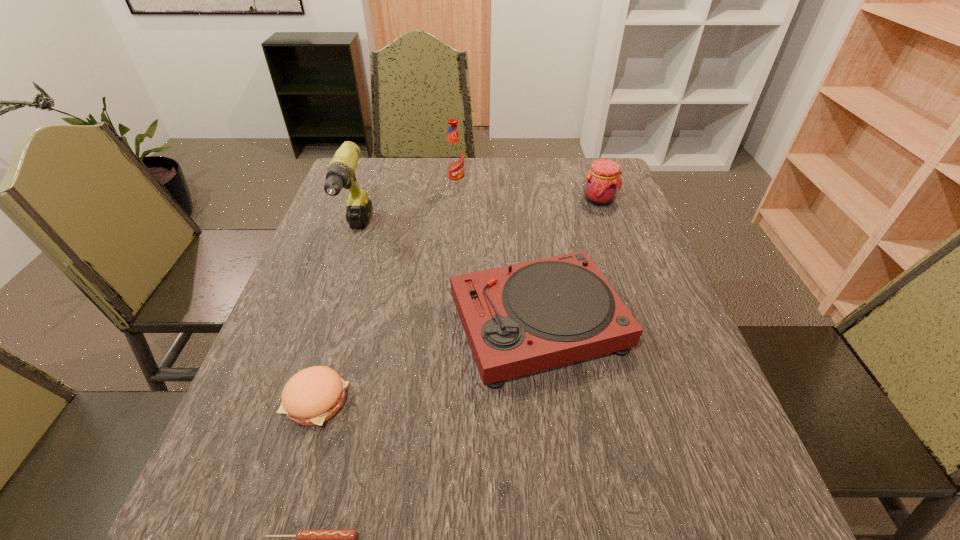
At what (x,y) coordinates should I click in order to perform the action: click on drill. Please return your answer as a coordinate pair (x, y). Looking at the image, I should click on (341, 171).

In order to click on root beer in this screenshot , I will do `click(454, 155)`.

At what (x,y) coordinates should I click in order to perform the action: click on the fourth shortest object. Please return your answer as a coordinate pair (x, y). This screenshot has width=960, height=540. Looking at the image, I should click on (602, 181).

Find the location of a particular element. This screenshot has width=960, height=540. record player is located at coordinates (523, 318).

Find the location of a particular element. Image resolution: width=960 pixels, height=540 pixels. patty is located at coordinates (312, 396).

Locate an element on the screen. free space located 0.130m on the handle side of the drill is located at coordinates (335, 297).

Where is `vacant space situated 0.230m on the front of the root beer`? vacant space situated 0.230m on the front of the root beer is located at coordinates (451, 239).

The height and width of the screenshot is (540, 960). I want to click on vacant region located 0.120m on the left of the fourth shortest object, so click(x=541, y=200).

This screenshot has width=960, height=540. In order to click on free region located on the back of the third shortest object in this screenshot , I will do `click(525, 224)`.

At what (x,y) coordinates should I click in order to perform the action: click on free space located 0.190m on the right of the patty. Please return your answer as a coordinate pair (x, y). The height and width of the screenshot is (540, 960). Looking at the image, I should click on (447, 401).